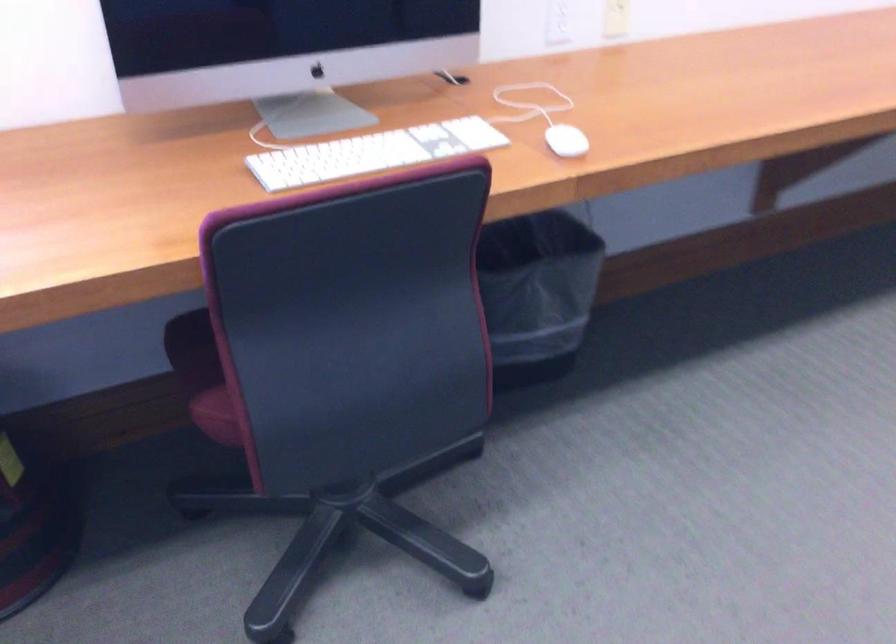
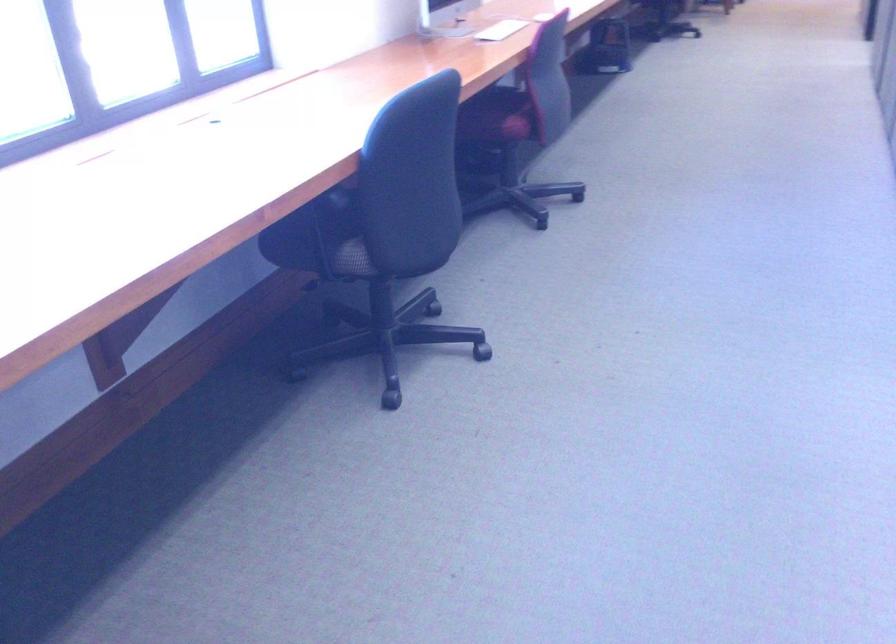
Question: I am providing you with two images of the same scene from different viewpoints. Which of the following objects are not visible in image2?

Choices:
 (A) chair sitting surface
 (B) black trash can
 (C) white paper
 (D) red magnet

Answer: (B)